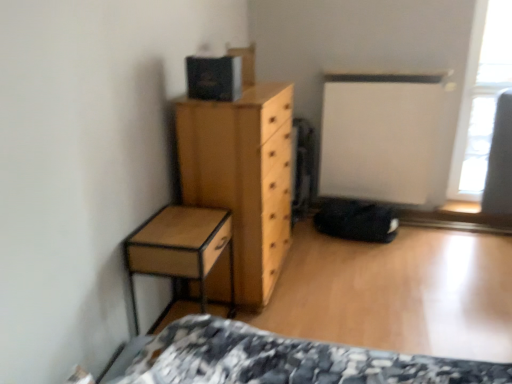
Question: Is light brown wood chest of drawers at center bigger than transparent glass window at upper right?

Choices:
 (A) yes
 (B) no

Answer: (A)

Question: Does light brown wood chest of drawers at center come behind transparent glass window at upper right?

Choices:
 (A) no
 (B) yes

Answer: (A)

Question: Is light brown wood chest of drawers at center with transparent glass window at upper right?

Choices:
 (A) yes
 (B) no

Answer: (B)

Question: Does light brown wood chest of drawers at center have a smaller size compared to transparent glass window at upper right?

Choices:
 (A) no
 (B) yes

Answer: (A)

Question: Could transparent glass window at upper right be considered to be inside light brown wood chest of drawers at center?

Choices:
 (A) yes
 (B) no

Answer: (B)

Question: Does light brown wood chest of drawers at center have a greater width compared to transparent glass window at upper right?

Choices:
 (A) no
 (B) yes

Answer: (B)

Question: Can we say transparent glass window at upper right lies outside wooden nightstand at left?

Choices:
 (A) yes
 (B) no

Answer: (A)

Question: Are transparent glass window at upper right and wooden nightstand at left beside each other?

Choices:
 (A) no
 (B) yes

Answer: (A)

Question: Is transparent glass window at upper right further to camera compared to wooden nightstand at left?

Choices:
 (A) yes
 (B) no

Answer: (A)

Question: Is transparent glass window at upper right surrounding wooden nightstand at left?

Choices:
 (A) yes
 (B) no

Answer: (B)

Question: Can you confirm if transparent glass window at upper right is bigger than wooden nightstand at left?

Choices:
 (A) yes
 (B) no

Answer: (B)

Question: From a real-world perspective, does transparent glass window at upper right sit lower than wooden nightstand at left?

Choices:
 (A) no
 (B) yes

Answer: (A)

Question: From the image's perspective, is transparent glass window at upper right above light brown wood chest of drawers at center?

Choices:
 (A) yes
 (B) no

Answer: (A)